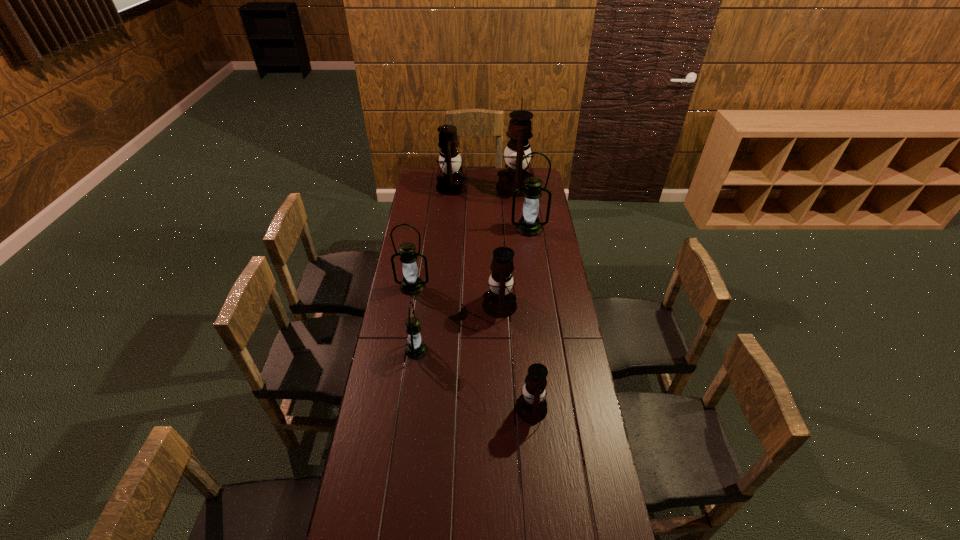
What are the coordinates of `the biggest brown lantern` in the screenshot? It's located at (519, 130).

This screenshot has width=960, height=540. I want to click on the tallest object, so click(x=519, y=130).

Locate an element on the screen. the second biggest brown lantern is located at coordinates (452, 182).

At what (x,y) coordinates should I click in order to perform the action: click on the fifth nearest object. Please return your answer as a coordinate pair (x, y). The height and width of the screenshot is (540, 960). Looking at the image, I should click on (529, 225).

At what (x,y) coordinates should I click in order to perform the action: click on the biggest green lantern. Please return your answer as a coordinate pair (x, y). Looking at the image, I should click on (529, 225).

The image size is (960, 540). Identify the location of the second nearest brown lantern. (499, 302).

Image resolution: width=960 pixels, height=540 pixels. Identify the location of the second nearest green lantern. (412, 284).

Where is `the nearest brown lantern`? The height and width of the screenshot is (540, 960). the nearest brown lantern is located at coordinates (531, 407).

Image resolution: width=960 pixels, height=540 pixels. Find the location of `the nearest lantern`. the nearest lantern is located at coordinates (531, 407).

At what (x,y) coordinates should I click in order to perform the action: click on the second nearest object. Please return your answer as a coordinate pair (x, y). Looking at the image, I should click on (416, 349).